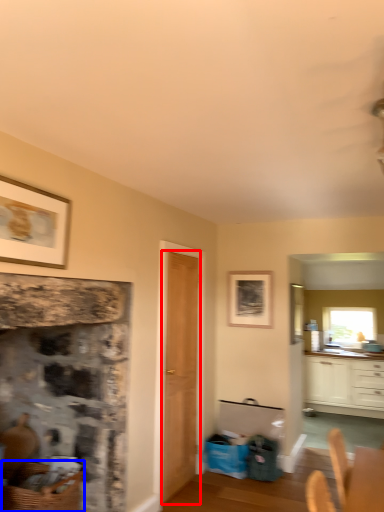
Question: Which object is further to the camera taking this photo, door (highlighted by a red box) or basket (highlighted by a blue box)?

Choices:
 (A) door
 (B) basket

Answer: (A)